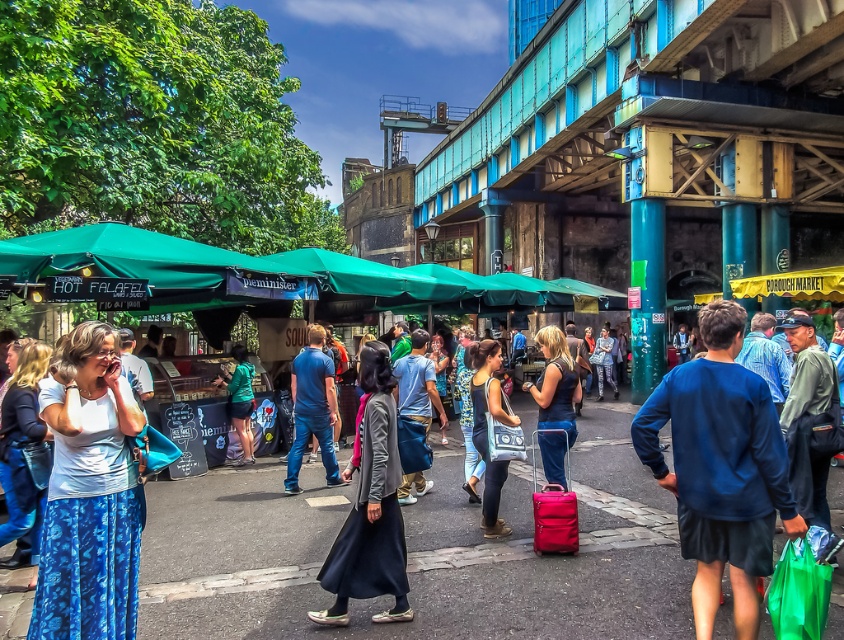
You are a photographer trying to capture both the dark gray fabric coat at center and the matte blue dress at center in a single frame. Given their sizes, which one should you focus on to ensure both are visible without zooming in too much?

The dark gray fabric coat at center is smaller than the matte blue dress at center, so focusing on the matte blue dress at center would allow both to be visible without excessive zooming.

You are standing at the point marked as point (x=381, y=419) in the market scene. A friend is waiting for you at the entrance, which is 5 meters away from your current position. Can you reach your friend without moving more than 5 meters?

The distance between point (x=381, y=419) and the viewer is 4.55 meters. Since the entrance is 5 meters away, you can reach your friend without moving more than 5 meters.